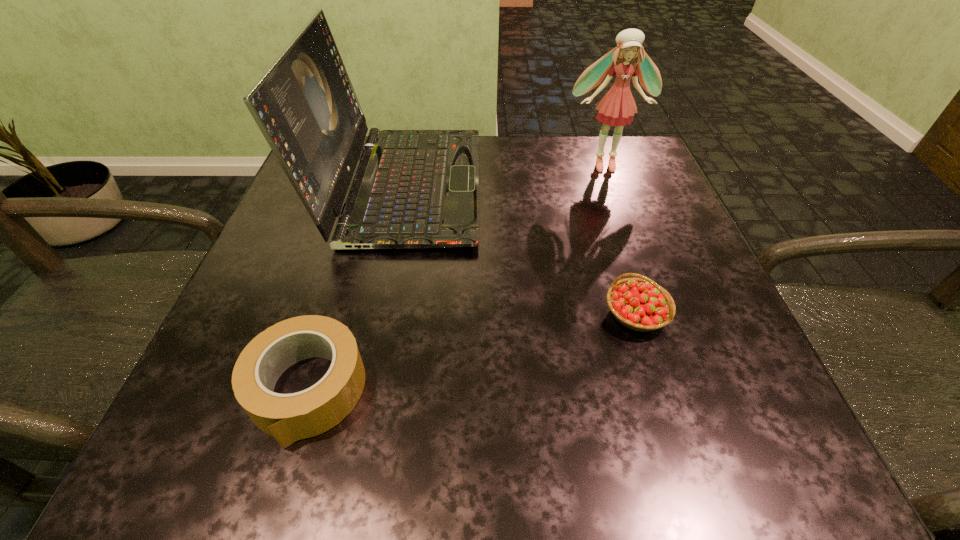
The width and height of the screenshot is (960, 540). I want to click on vacant space in between the shortest object and the doll, so [455, 277].

Identify the location of object that is the second closest to the doll. (640, 304).

Where is `object that stands as the closest to the duct tape`? object that stands as the closest to the duct tape is located at coordinates (413, 188).

Where is `vacant area in the image that satisfies the following two spatial constraints: 1. on the front-facing side of the doll; 2. on the screen of the laptop computer`? The width and height of the screenshot is (960, 540). vacant area in the image that satisfies the following two spatial constraints: 1. on the front-facing side of the doll; 2. on the screen of the laptop computer is located at coordinates (612, 186).

What are the coordinates of `free space that satisfies the following two spatial constraints: 1. on the screen of the laptop computer; 2. on the back side of the third tallest object` in the screenshot? It's located at (376, 314).

The image size is (960, 540). I want to click on vacant space that satisfies the following two spatial constraints: 1. on the screen of the laptop computer; 2. on the left side of the third tallest object, so click(376, 314).

Locate an element on the screen. vacant region that satisfies the following two spatial constraints: 1. on the front-facing side of the doll; 2. on the screen of the laptop computer is located at coordinates (612, 186).

Find the location of `free space that satisfies the following two spatial constraints: 1. on the screen of the laptop computer; 2. on the back side of the strawberry`. free space that satisfies the following two spatial constraints: 1. on the screen of the laptop computer; 2. on the back side of the strawberry is located at coordinates (376, 314).